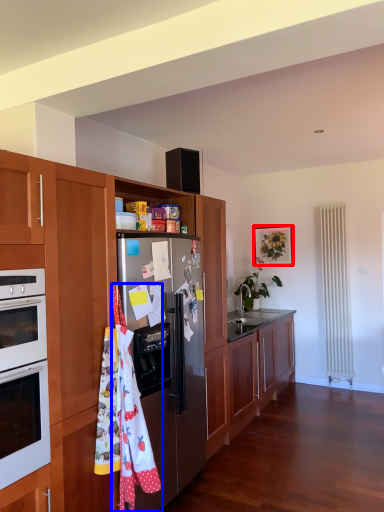
Question: Which object appears closest to the camera in this image, picture frame (highlighted by a red box) or material (highlighted by a blue box)?

Choices:
 (A) picture frame
 (B) material

Answer: (B)